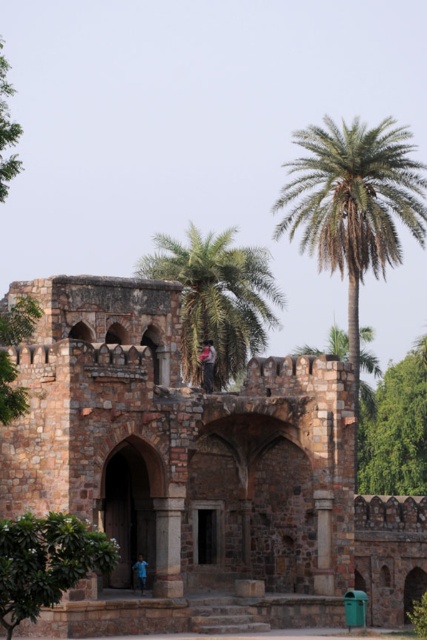
Consider the image. You are a landscape architect designing a garden around the ancient stone structure. You have two green leafy trees to place in the courtyard. The green leafy palm tree at center and the green leafy tree at lower left. Which tree should you choose if you want a wider canopy to provide more shade?

The green leafy palm tree at center has a larger width than the green leafy tree at lower left, so it would provide a wider canopy and more shade.

You are an architect planning to build a new garden next to the brown stone fort at center and the green leafy tree at lower left. Considering their sizes, which one requires more space horizontally?

The brown stone fort at center requires more horizontal space because its width surpasses that of the green leafy tree at lower left.